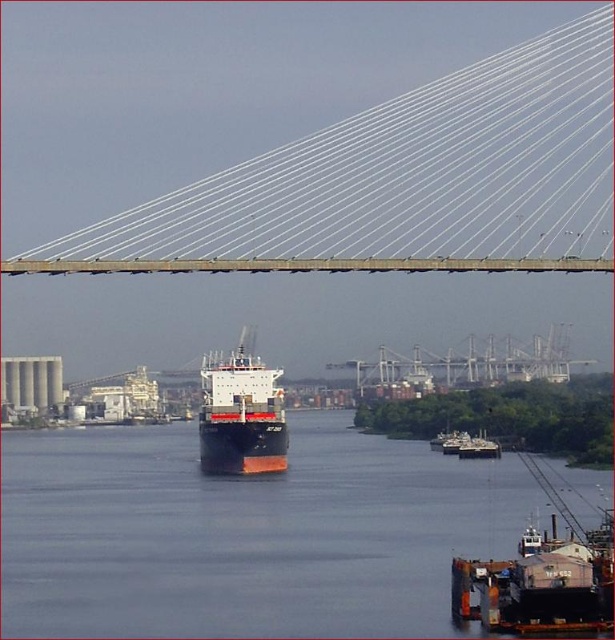
You are standing on the deck of the metallic gray boat at center and want to throw a lifebuoy into the dark blue water at center. In which direction should you throw it relative to the boat?

The dark blue water at center is positioned on the left side of the metallic gray boat at center, so you should throw the lifebuoy to the left side of the boat to reach the dark blue water at center.